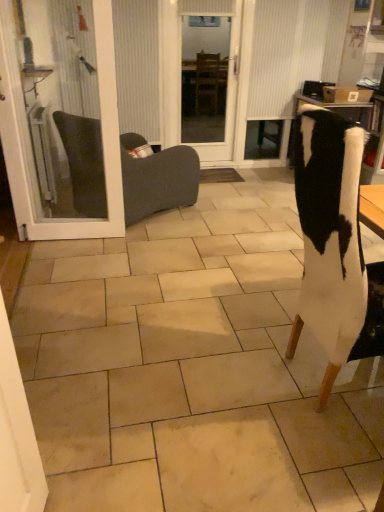
What are the coordinates of `free space in front of white fur chair at right, placed as the second chair when sorted from left to right` in the screenshot? It's located at (326, 451).